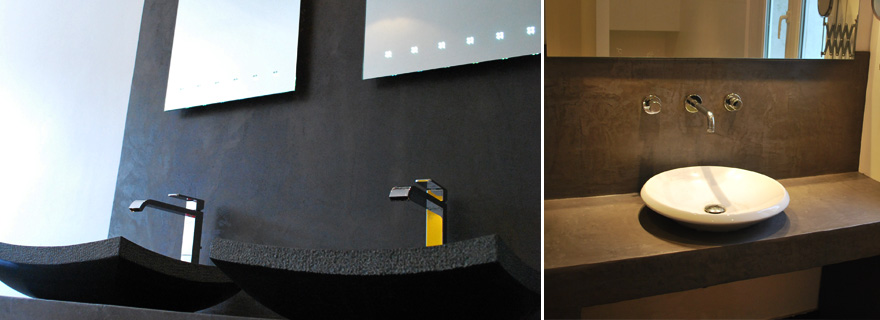
Where is `sinks`? sinks is located at coordinates (708, 196), (378, 274), (94, 276).